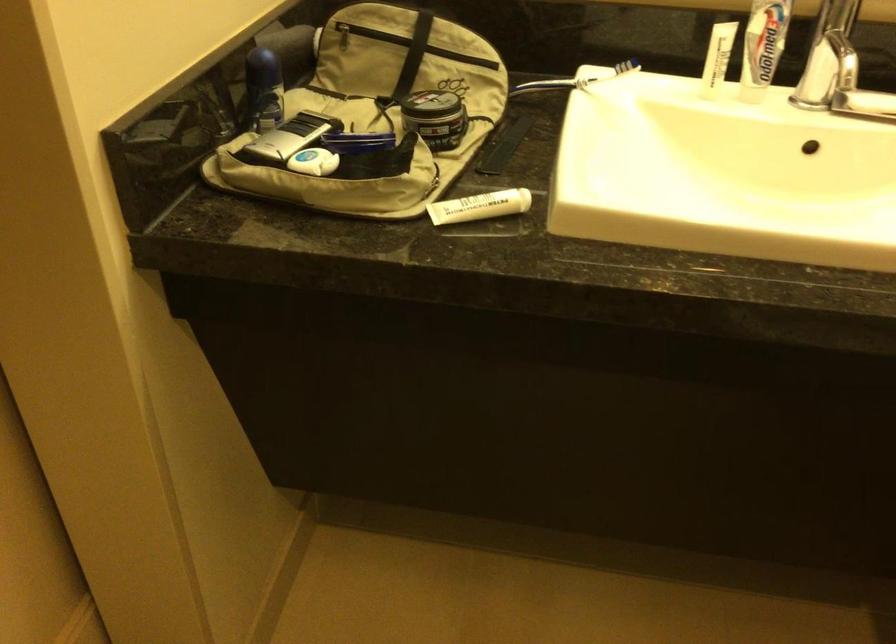
Where would you twist the black container lid? Please return your answer as a coordinate pair (x, y).

(433, 105)